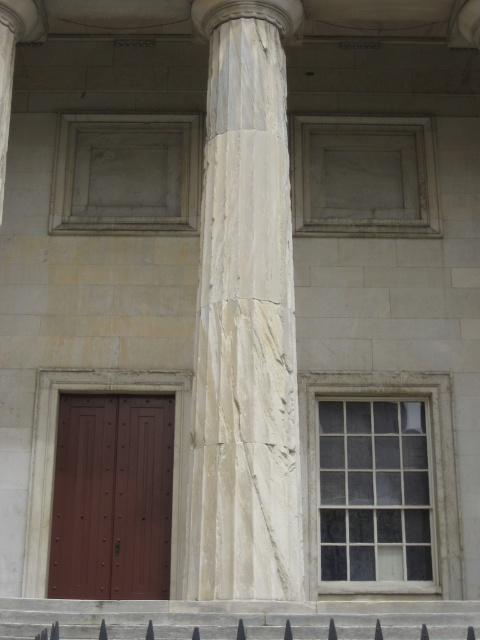
Does white marble column at center have a lesser height compared to black metal fence at lower center?

In fact, white marble column at center may be taller than black metal fence at lower center.

Locate an element on the screen. The height and width of the screenshot is (640, 480). white marble column at center is located at coordinates (245, 316).

Does point (217, 237) come closer to viewer compared to point (422, 614)?

No, (217, 237) is further to viewer.

Identify the location of white marble column at center. Image resolution: width=480 pixels, height=640 pixels. (245, 316).